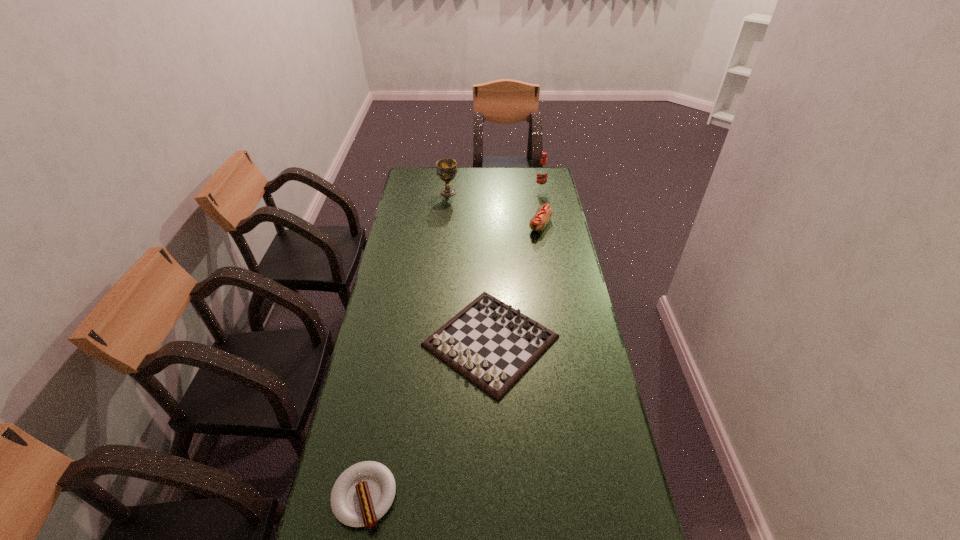
Find the location of a particular element. The width and height of the screenshot is (960, 540). free space that satisfies the following two spatial constraints: 1. on the back side of the root beer; 2. on the right side of the farther sausage is located at coordinates (534, 188).

I want to click on free region that satisfies the following two spatial constraints: 1. on the back side of the shortest object; 2. on the left side of the taller sausage, so click(x=415, y=226).

You are a GUI agent. You are given a task and a screenshot of the screen. Output one action in this format:
    pyautogui.click(x=<x>, y=<y>)
    Task: Click on the free space that satisfies the following two spatial constraints: 1. on the front side of the chessboard; 2. on the right side of the second tallest object
    
    Given the screenshot: What is the action you would take?
    pyautogui.click(x=433, y=341)

What are the coordinates of `blank space that satisfies the following two spatial constraints: 1. on the back side of the leftmost object; 2. on the right side of the chalice` in the screenshot? It's located at [x=421, y=192].